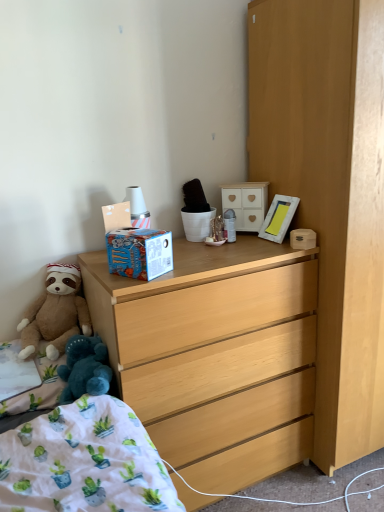
Question: Should I look upward or downward to see brown plush teddy bear at lower left?

Choices:
 (A) down
 (B) up

Answer: (A)

Question: Is light wood dresser at center oriented towards white painted wood cabinet at upper center, which is counted as the 2th cabinetry, starting from the right?

Choices:
 (A) yes
 (B) no

Answer: (B)

Question: Is light wood dresser at center not close to white painted wood cabinet at upper center, which is the 2th cabinetry from bottom to top?

Choices:
 (A) no
 (B) yes

Answer: (A)

Question: From a real-world perspective, is light wood dresser at center physically below white painted wood cabinet at upper center, the first cabinetry from the left?

Choices:
 (A) no
 (B) yes

Answer: (B)

Question: Does light wood dresser at center have a smaller size compared to white painted wood cabinet at upper center, acting as the 1th cabinetry starting from the back?

Choices:
 (A) yes
 (B) no

Answer: (B)

Question: Does light wood dresser at center have a larger size compared to white painted wood cabinet at upper center, which is counted as the 2th cabinetry, starting from the right?

Choices:
 (A) yes
 (B) no

Answer: (A)

Question: Is light wood dresser at center to the left of white painted wood cabinet at upper center, the first cabinetry from the left, from the viewer's perspective?

Choices:
 (A) no
 (B) yes

Answer: (B)

Question: Does light wood dresser at center turn towards white wooden picture frame at upper right?

Choices:
 (A) yes
 (B) no

Answer: (B)

Question: Is light wood dresser at center outside of white wooden picture frame at upper right?

Choices:
 (A) yes
 (B) no

Answer: (A)

Question: Considering the relative sizes of light wood dresser at center and white wooden picture frame at upper right in the image provided, is light wood dresser at center wider than white wooden picture frame at upper right?

Choices:
 (A) yes
 (B) no

Answer: (A)

Question: Can you confirm if light wood dresser at center is positioned to the right of white wooden picture frame at upper right?

Choices:
 (A) no
 (B) yes

Answer: (A)

Question: From a real-world perspective, is light wood dresser at center over white wooden picture frame at upper right?

Choices:
 (A) yes
 (B) no

Answer: (B)

Question: Is light wood dresser at center facing away from white wooden picture frame at upper right?

Choices:
 (A) no
 (B) yes

Answer: (A)

Question: From the image's perspective, is light wood dresser at right, which ranks as the first cabinetry in right-to-left order, beneath light wood dresser at center?

Choices:
 (A) no
 (B) yes

Answer: (A)